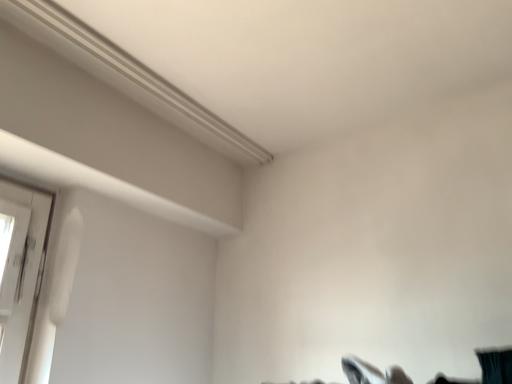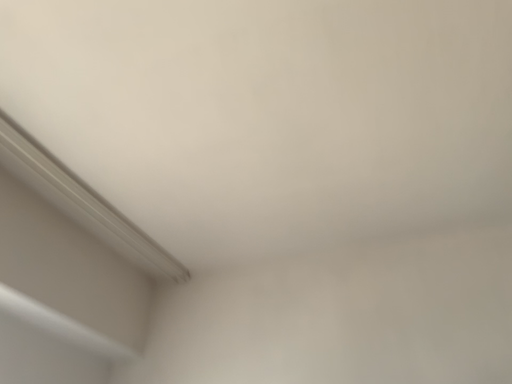
Question: Which way did the camera rotate in the video?

Choices:
 (A) rotated right
 (B) rotated left

Answer: (A)